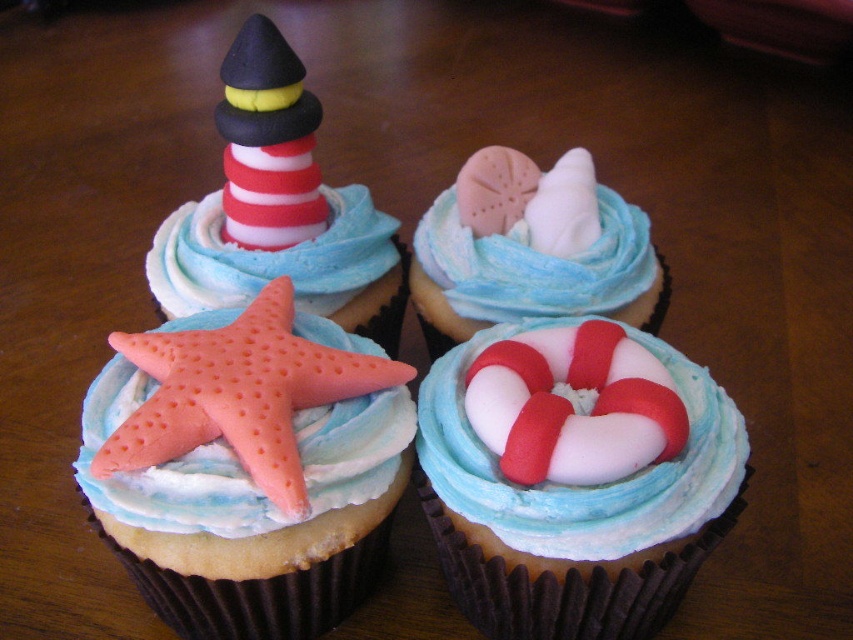
Question: Does smooth white life preserver at center appear on the left side of pink matte starfish at center?

Choices:
 (A) no
 (B) yes

Answer: (A)

Question: Among these points, which one is farthest from the camera?

Choices:
 (A) (207, 348)
 (B) (711, 445)

Answer: (A)

Question: Among these points, which one is farthest from the camera?

Choices:
 (A) (90, 467)
 (B) (474, 320)
 (C) (583, 637)
 (D) (374, 323)

Answer: (D)

Question: Considering the relative positions of smooth white life preserver at center and matte pink starfish at upper left in the image provided, where is smooth white life preserver at center located with respect to matte pink starfish at upper left?

Choices:
 (A) above
 (B) below

Answer: (B)

Question: Which point is farther to the camera?

Choices:
 (A) (323, 376)
 (B) (682, 362)
 (C) (360, 314)
 (D) (468, 308)

Answer: (C)

Question: Does smooth white life preserver at center have a greater width compared to pink matte starfish at center?

Choices:
 (A) no
 (B) yes

Answer: (B)